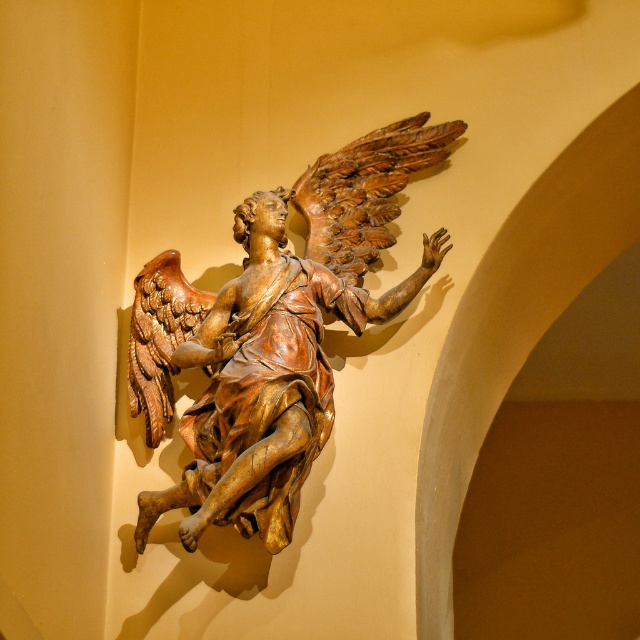
Is gold polished wood angel at center to the left of golden polished wood wing at upper center from the viewer's perspective?

Indeed, gold polished wood angel at center is positioned on the left side of golden polished wood wing at upper center.

Is gold polished wood angel at center bigger than golden polished wood wing at upper center?

Yes.

Is point (310, 392) behind point (378, 156)?

No, (310, 392) is in front of (378, 156).

At what (x,y) coordinates should I click in order to perform the action: click on gold polished wood angel at center. Please return your answer as a coordinate pair (x, y). Looking at the image, I should click on (273, 333).